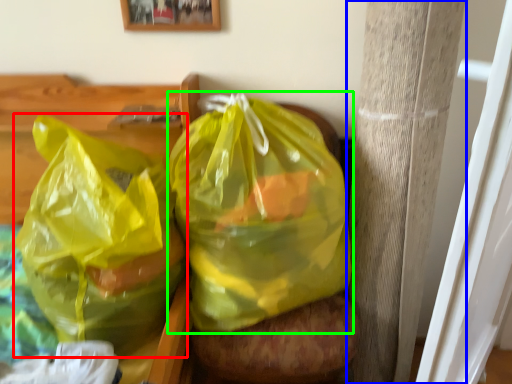
Question: Which object is positioned farthest from plastic bag (highlighted by a red box)? Select from pillar (highlighted by a blue box) and plastic bag (highlighted by a green box).

Choices:
 (A) pillar
 (B) plastic bag

Answer: (A)